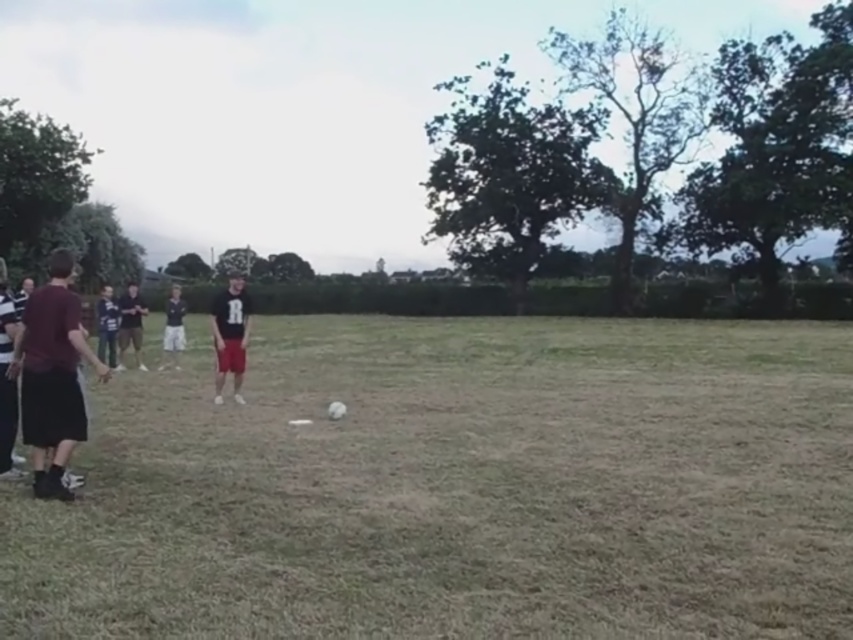
Which of these two, dark red fabric shorts at left or dark gray shirt at left, stands shorter?

With less height is dark gray shirt at left.

Which is behind, point (61, 385) or point (136, 353)?

The point (136, 353) is more distant.

This screenshot has width=853, height=640. In order to click on dark red fabric shorts at left in this screenshot , I will do `click(51, 376)`.

Can you confirm if grassy field at lower left is taller than matte black shirt at center?

No.

Locate an element on the screen. grassy field at lower left is located at coordinates (457, 486).

Consider the image. Is dark red fabric shorts at left positioned before matte black shirt at center?

Yes, dark red fabric shorts at left is in front of matte black shirt at center.

Does dark red fabric shorts at left have a lesser width compared to matte black shirt at center?

In fact, dark red fabric shorts at left might be wider than matte black shirt at center.

Is point (76, 323) closer to viewer compared to point (218, 296)?

That is True.

You are a GUI agent. You are given a task and a screenshot of the screen. Output one action in this format:
    pyautogui.click(x=<x>, y=<y>)
    Task: Click on the dark red fabric shorts at left
    The width and height of the screenshot is (853, 640).
    Given the screenshot: What is the action you would take?
    pyautogui.click(x=51, y=376)